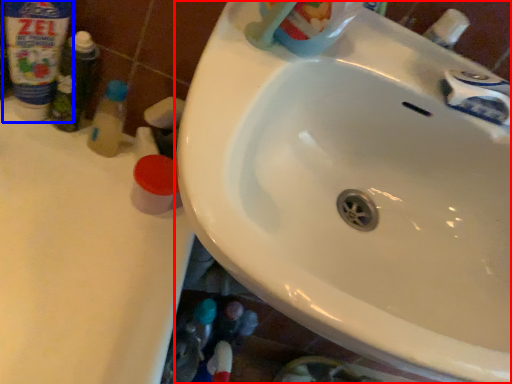
Question: Which of the following is the farthest to the observer, sink (highlighted by a red box) or cleaning product (highlighted by a blue box)?

Choices:
 (A) sink
 (B) cleaning product

Answer: (B)